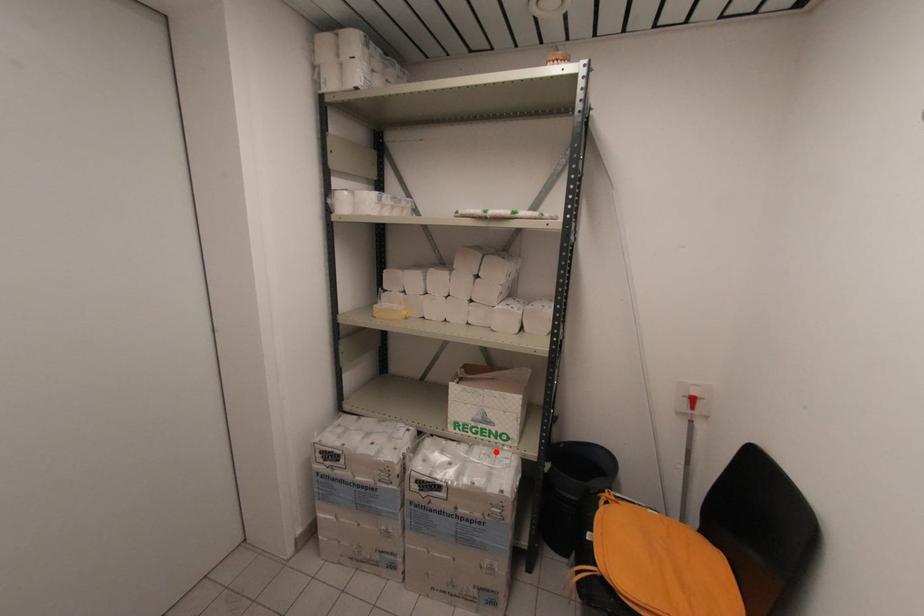
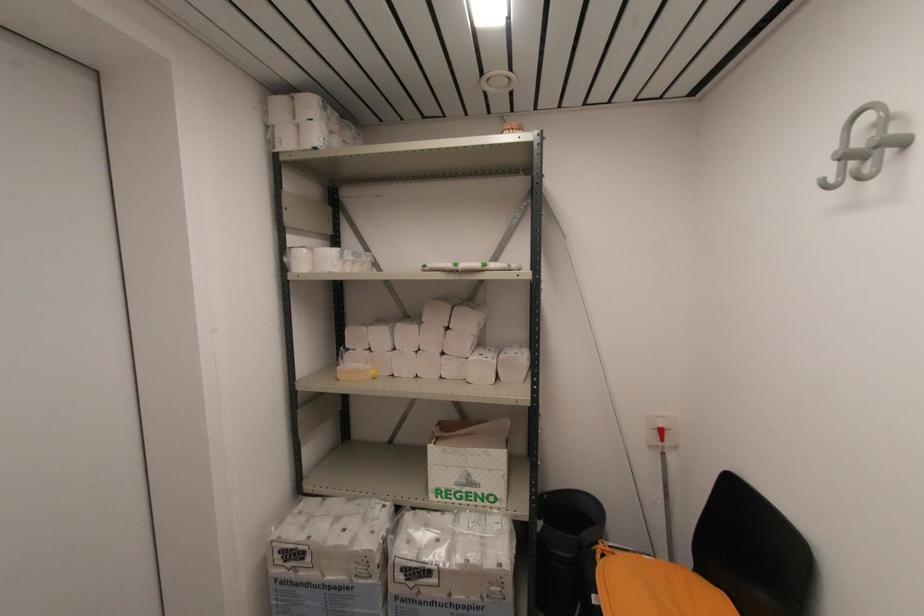
Question: I am providing you with two images of the same scene from different viewpoints. A red point is marked on the first image. Can you still see the location of the red point in image 2?

Choices:
 (A) Yes
 (B) No

Answer: (A)